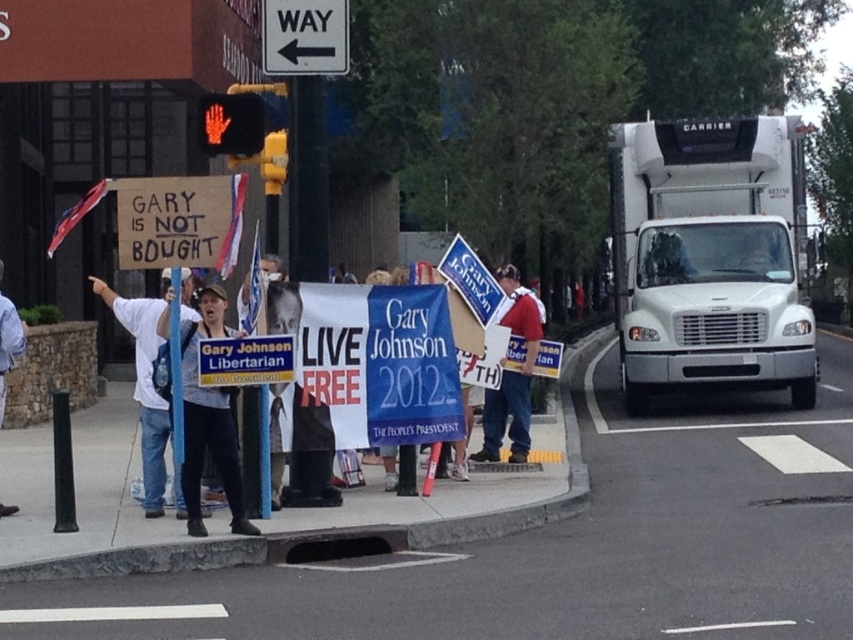
Who is taller, white cotton shirt at center or white plastic sign at upper center?

Standing taller between the two is white cotton shirt at center.

The height and width of the screenshot is (640, 853). Describe the element at coordinates (209, 420) in the screenshot. I see `white cotton shirt at center` at that location.

Locate an element on the screen. The image size is (853, 640). white cotton shirt at center is located at coordinates (209, 420).

Looking at this image, which of these two, cardboard sign at center or yellow plastic traffic light at upper center, stands shorter?

yellow plastic traffic light at upper center

Is point (207, 186) positioned before point (270, 157)?

That is True.

At what (x,y) coordinates should I click in order to perform the action: click on cardboard sign at center. Please return your answer as a coordinate pair (x, y). Looking at the image, I should click on (177, 220).

Does white plastic sign at upper center have a greater height compared to denim jacket at lower left?

No, white plastic sign at upper center is not taller than denim jacket at lower left.

From the picture: Does white plastic sign at upper center have a larger size compared to denim jacket at lower left?

Correct, white plastic sign at upper center is larger in size than denim jacket at lower left.

Is point (331, 20) farther from camera compared to point (7, 369)?

Yes, point (331, 20) is farther from viewer.

At what (x,y) coordinates should I click in order to perform the action: click on white plastic sign at upper center. Please return your answer as a coordinate pair (x, y). Looking at the image, I should click on (305, 36).